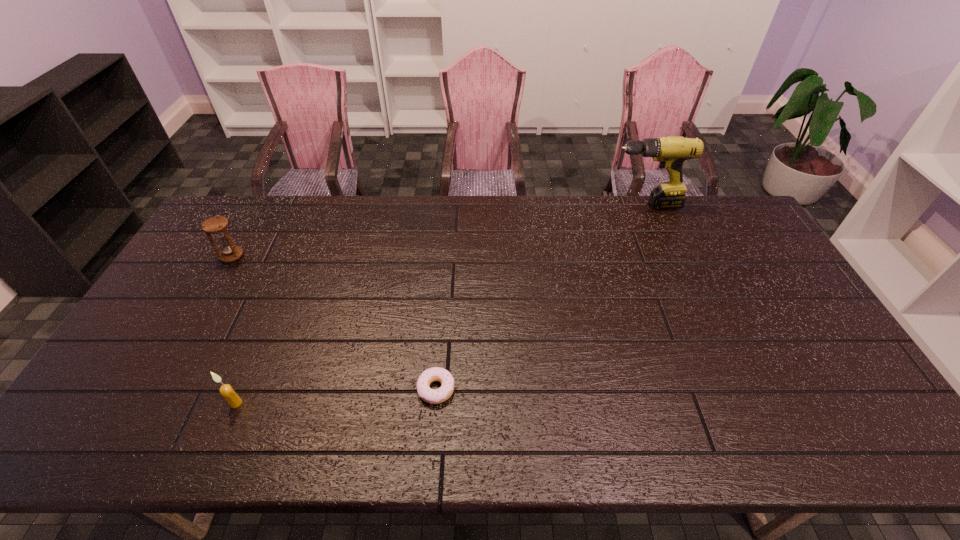
The width and height of the screenshot is (960, 540). Find the location of `drill`. drill is located at coordinates (671, 151).

Locate an element on the screen. The image size is (960, 540). the rightmost object is located at coordinates (671, 151).

This screenshot has height=540, width=960. In order to click on the leftmost object in this screenshot , I will do `click(217, 226)`.

What are the coordinates of `hourglass` in the screenshot? It's located at (217, 226).

Find the location of a particular element. The width and height of the screenshot is (960, 540). the third object from right to left is located at coordinates tap(226, 390).

Where is `the shortest object`? The width and height of the screenshot is (960, 540). the shortest object is located at coordinates (433, 396).

Image resolution: width=960 pixels, height=540 pixels. Identify the location of the second object from right to left. (433, 396).

The height and width of the screenshot is (540, 960). In order to click on free space located on the handle side of the tallest object in this screenshot , I will do `click(547, 205)`.

You are a GUI agent. You are given a task and a screenshot of the screen. Output one action in this format:
    pyautogui.click(x=<x>, y=<y>)
    Task: Click on the vacant space situated 0.270m on the handle side of the tallest object
    
    Given the screenshot: What is the action you would take?
    pyautogui.click(x=534, y=205)

At what (x,y) coordinates should I click in order to perform the action: click on free space located 0.320m on the handle side of the tallest object. Please return your answer as a coordinate pair (x, y). This screenshot has width=960, height=540. Looking at the image, I should click on (520, 205).